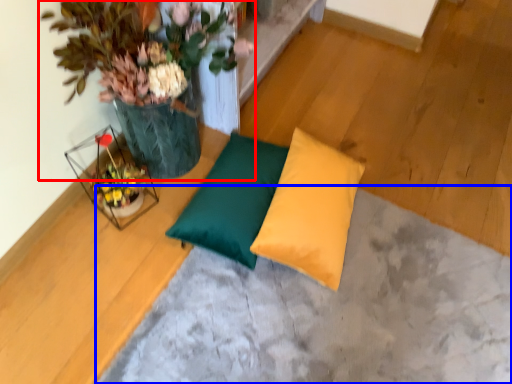
Question: Which point is closer to the camera, houseplant (highlighted by a red box) or concrete (highlighted by a blue box)?

Choices:
 (A) houseplant
 (B) concrete

Answer: (A)